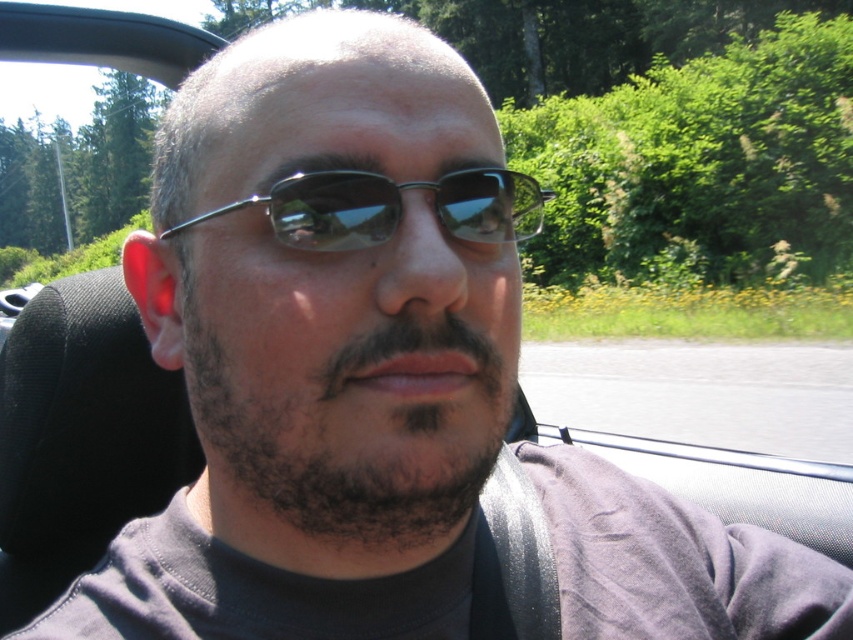
Can you confirm if dark brown fuzzy beard at center is positioned above metallic frame sunglasses at center?

No.

Between dark brown fuzzy beard at center and metallic frame sunglasses at center, which one is positioned higher?

metallic frame sunglasses at center is above.

Image resolution: width=853 pixels, height=640 pixels. What do you see at coordinates (346, 403) in the screenshot? I see `dark brown fuzzy beard at center` at bounding box center [346, 403].

Where is `dark brown fuzzy beard at center`? dark brown fuzzy beard at center is located at coordinates (346, 403).